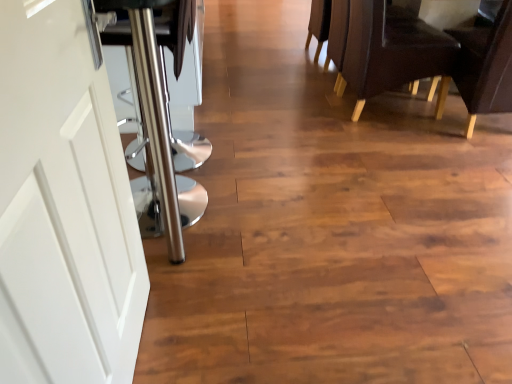
Locate an element on the screen. This screenshot has width=512, height=384. free space that is to the left of leather-like dark brown chair at right, the 1th chair from the left is located at coordinates (300, 111).